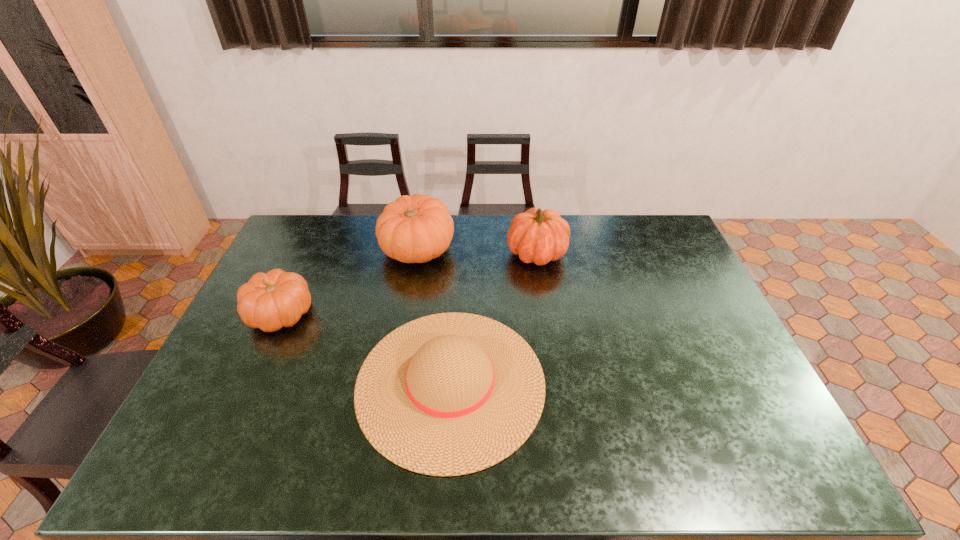
I want to click on the rightmost pumpkin, so click(537, 236).

This screenshot has height=540, width=960. Find the location of `the second pumpkin from left to right`. the second pumpkin from left to right is located at coordinates (414, 229).

I want to click on the leftmost pumpkin, so click(x=277, y=299).

At what (x,y) coordinates should I click in order to perform the action: click on the leftmost object. Please return your answer as a coordinate pair (x, y). The height and width of the screenshot is (540, 960). Looking at the image, I should click on (277, 299).

Image resolution: width=960 pixels, height=540 pixels. In order to click on bonnet in this screenshot , I will do `click(448, 394)`.

Where is `free spot located on the back of the rightmost pumpkin`? The width and height of the screenshot is (960, 540). free spot located on the back of the rightmost pumpkin is located at coordinates (533, 225).

I want to click on vacant space situated 0.290m on the front of the second pumpkin from right to left, so point(402,339).

You are a GUI agent. You are given a task and a screenshot of the screen. Output one action in this format:
    pyautogui.click(x=<x>, y=<y>)
    Task: Click on the free space located 0.340m on the back of the leftmost pumpkin
    This screenshot has height=540, width=960.
    Given the screenshot: What is the action you would take?
    pyautogui.click(x=320, y=229)

Image resolution: width=960 pixels, height=540 pixels. I want to click on free space located 0.210m on the back of the bonnet, so click(x=457, y=269).

You are a GUI agent. You are given a task and a screenshot of the screen. Output one action in this format:
    pyautogui.click(x=<x>, y=<y>)
    Task: Click on the object located at the near edge
    This screenshot has width=960, height=540.
    Given the screenshot: What is the action you would take?
    pyautogui.click(x=448, y=394)